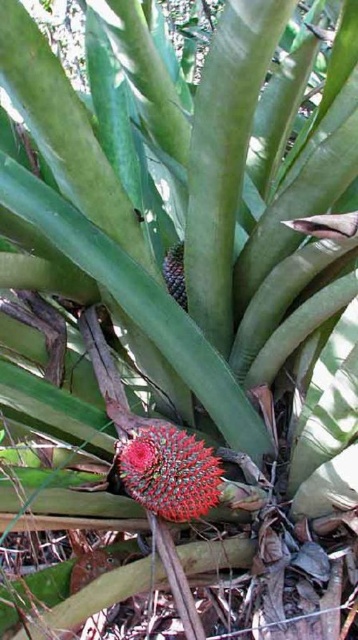
Question: Is shiny red spiky fruit at center smaller than satin purple pineapple at center?

Choices:
 (A) yes
 (B) no

Answer: (B)

Question: Is shiny red spiky fruit at center to the right of satin purple pineapple at center from the viewer's perspective?

Choices:
 (A) no
 (B) yes

Answer: (A)

Question: Which point is closer to the camera taking this photo?

Choices:
 (A) (186, 440)
 (B) (180, 266)

Answer: (A)

Question: Is shiny red spiky fruit at center wider than satin purple pineapple at center?

Choices:
 (A) no
 (B) yes

Answer: (B)